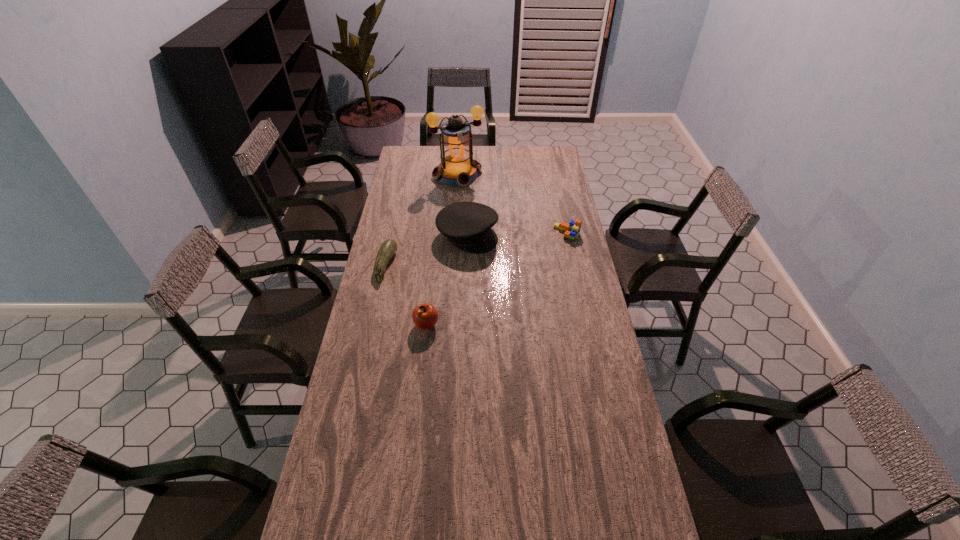
Where is `the nearest object`? The height and width of the screenshot is (540, 960). the nearest object is located at coordinates (424, 316).

I want to click on Lego, so click(x=572, y=230).

Image resolution: width=960 pixels, height=540 pixels. Identify the location of lantern. (457, 168).

Identify the location of the tallest object. (457, 168).

Locate an element on the screen. beret is located at coordinates (468, 225).

This screenshot has height=540, width=960. Identify the location of the leftmost object. (388, 248).

Find the location of `vacant space located 0.080m on the left of the apple`. vacant space located 0.080m on the left of the apple is located at coordinates (392, 325).

This screenshot has height=540, width=960. I want to click on free space located 0.120m on the left of the Lego, so click(x=528, y=233).

Where is `vacant area situated on the front-facing side of the lantern`? This screenshot has height=540, width=960. vacant area situated on the front-facing side of the lantern is located at coordinates (473, 201).

Where is `blank space located 0.360m on the front-facing side of the lantern`? This screenshot has height=540, width=960. blank space located 0.360m on the front-facing side of the lantern is located at coordinates click(490, 230).